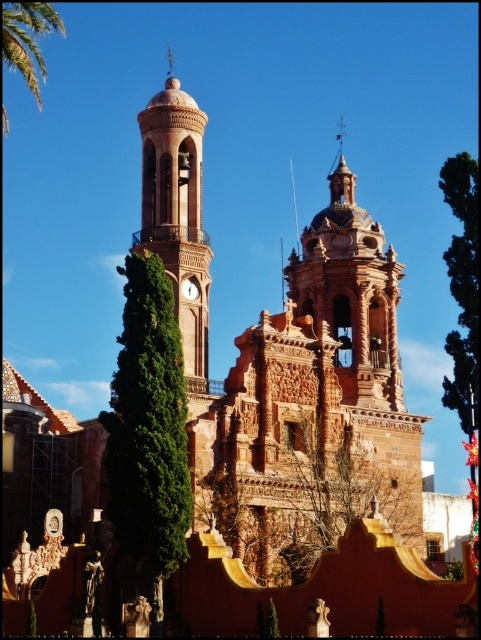
You are an architect analyzing the symmetry of the building. Which of the two green leafy trees, the green leafy tree at upper right or the green leafy palm tree at upper left, is bigger in size?

The green leafy tree at upper right is larger in size compared to the green leafy palm tree at upper left according to the description.

You are standing in front of the architectural structure described. You notice a green leafy tree at center. If you want to take a photo that includes both the tree and the structure, would you need to zoom in or zoom out?

The green leafy tree at center is 177.57 feet away from the camera. Since the tree is relatively far away, you would need to zoom out to capture both the tree and the structure in the same frame.